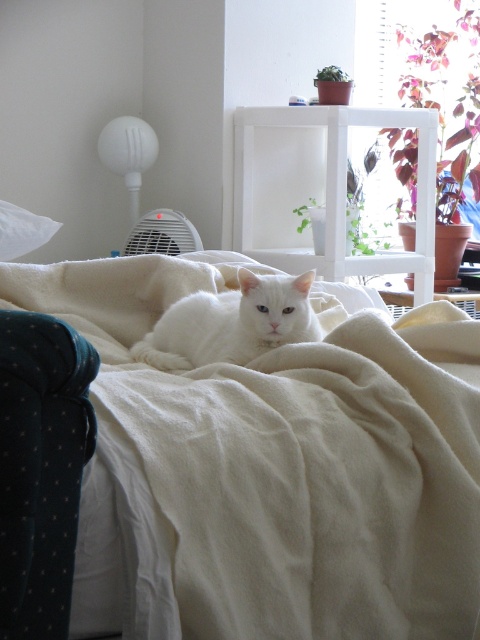
You are a photographer trying to capture the white fluffy cat at center. To ensure the cat stays visible, you need to know if it is sitting on top of or behind the white soft blanket at center. Based on the scene description, what is the relationship between the cat and the blanket?

The white fluffy cat at center is sitting on top of the white soft blanket at center since the blanket is positioned under the cat.

You are standing in the room and want to take a photo of the point at coordinate point (x=220, y=458). If your camera has a maximum focus distance of 1.2 meters, will it be able to focus on that point?

The point at coordinate point (x=220, y=458) is 1.15 meters from the camera, which is within the maximum focus distance of 1.2 meters. Therefore, the camera should be able to focus on that point.